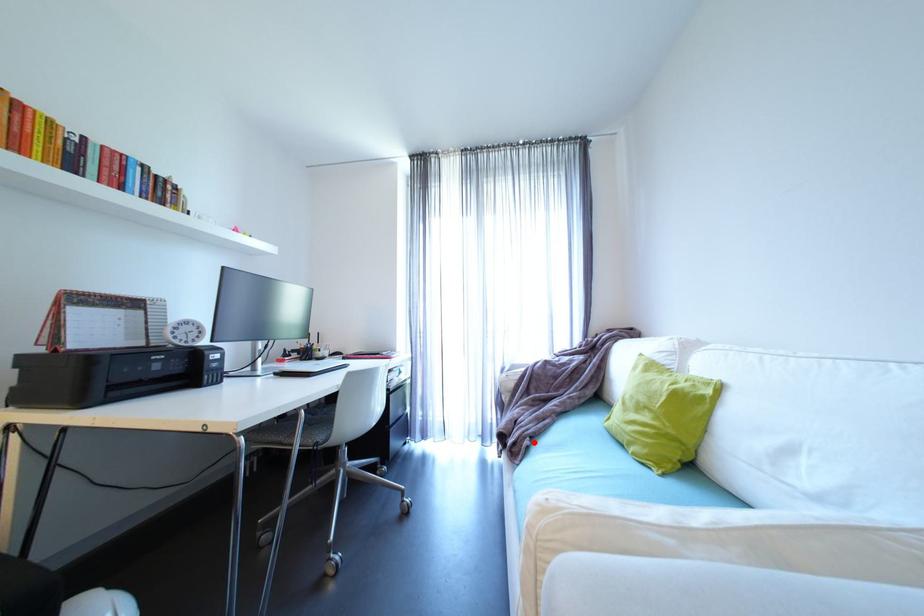
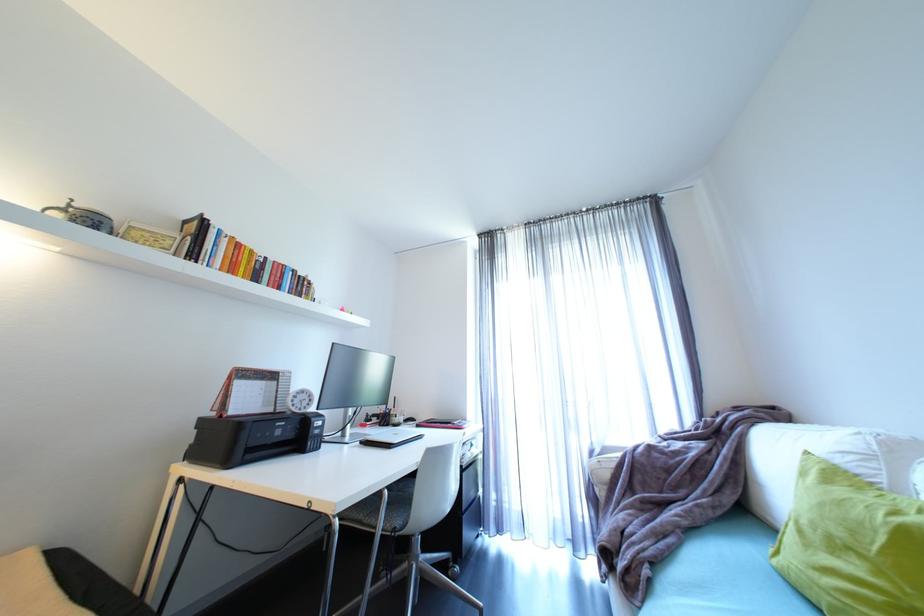
The point at the highlighted location is marked in the first image. Where is the corresponding point in the second image?

(653, 572)